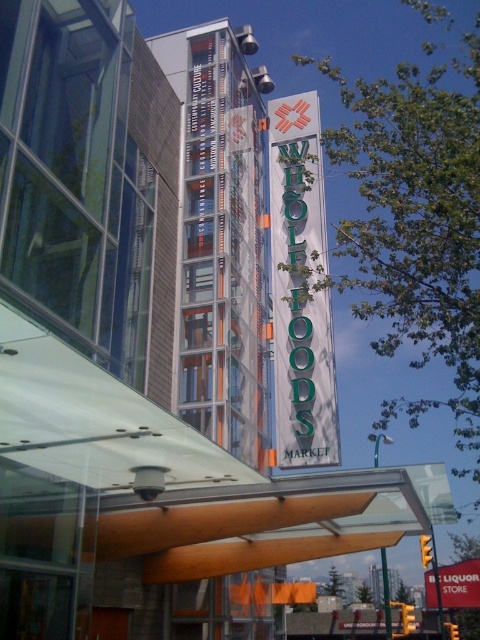
Is green matte sign at upper center below red plastic sign at upper center?

No, green matte sign at upper center is not below red plastic sign at upper center.

Is point (289, 214) farther from camera compared to point (465, 596)?

No, it is in front of (465, 596).

Locate an element on the screen. This screenshot has width=480, height=640. green matte sign at upper center is located at coordinates (300, 289).